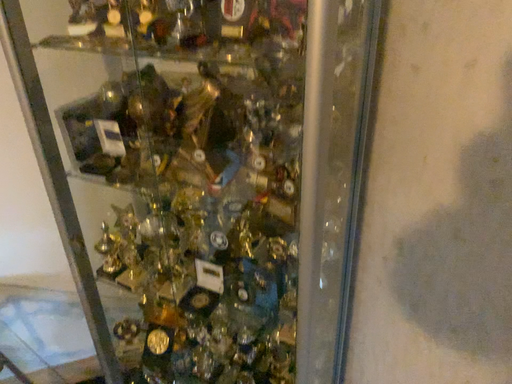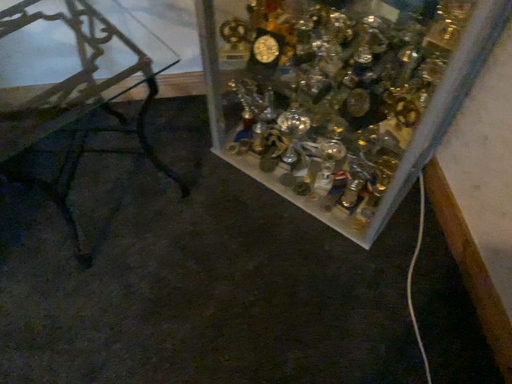
Question: How did the camera likely rotate when shooting the video?

Choices:
 (A) rotated left
 (B) rotated right

Answer: (A)